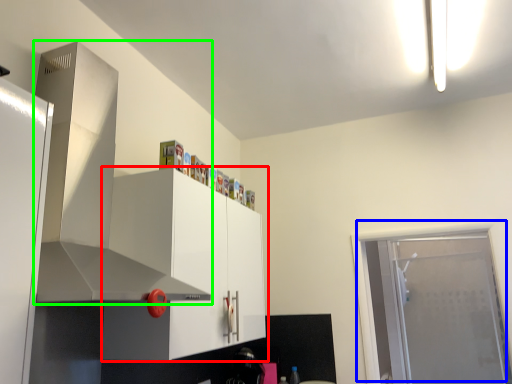
Question: Considering the real-world distances, which object is farthest from cabinetry (highlighted by a red box)? door (highlighted by a blue box) or exhaust hood (highlighted by a green box)?

Choices:
 (A) door
 (B) exhaust hood

Answer: (A)